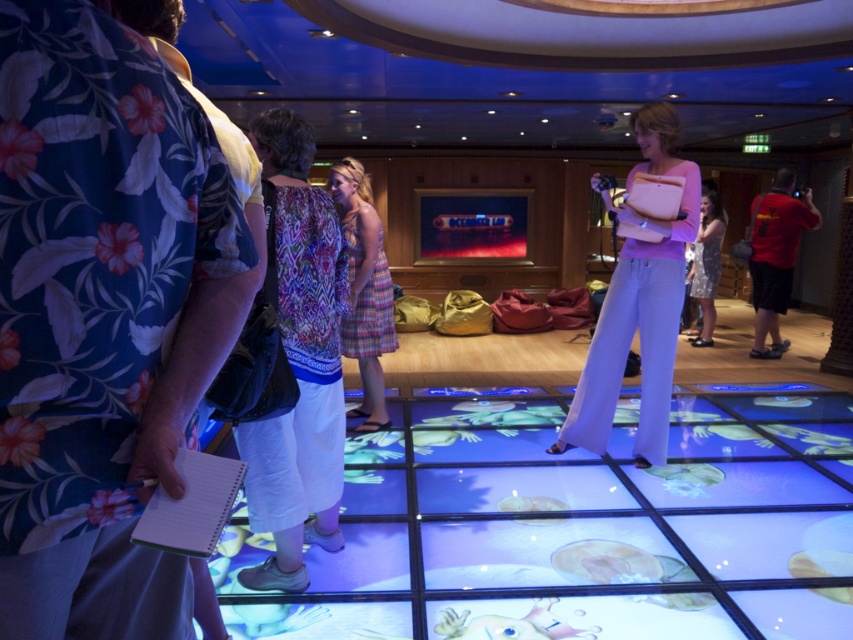
You are a photographer positioned at the back of the room. You need to capture a photo of both the plaid fabric dress at center and the red shirt at right without any obstruction. Based on their positions, which subject should you focus on first to ensure both are in frame?

The plaid fabric dress at center is below the red shirt at right, so you should focus on the red shirt at right first to ensure both are in frame.

You are a photographer standing in the cruise ship venue. You need to capture a photo of both the printed fabric blouse at center and the red shirt at right. Which one should you zoom in on to ensure it appears larger in the photo?

Since the printed fabric blouse at center is smaller than the red shirt at right, you should zoom in on the printed fabric blouse at center to make it appear larger in the photo compared to the red shirt at right.